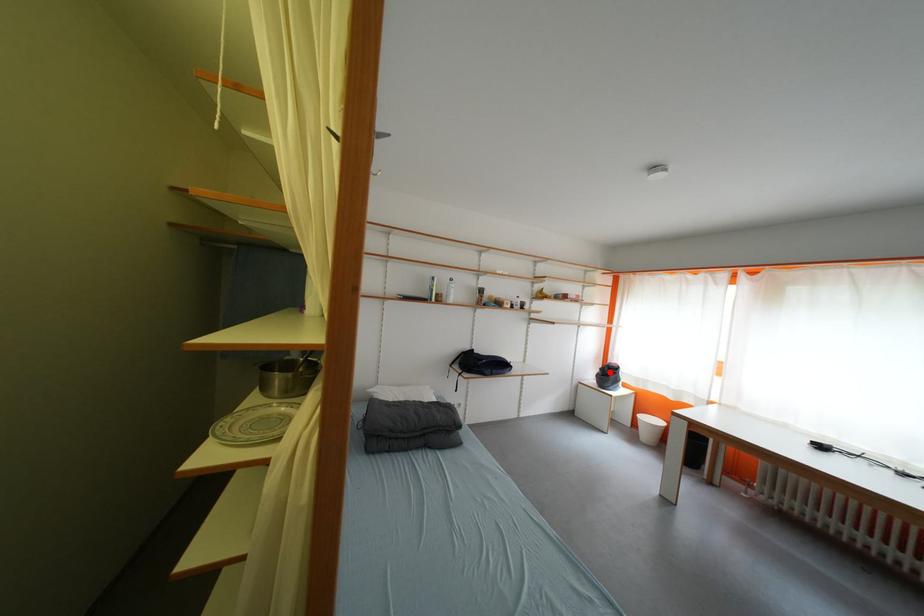
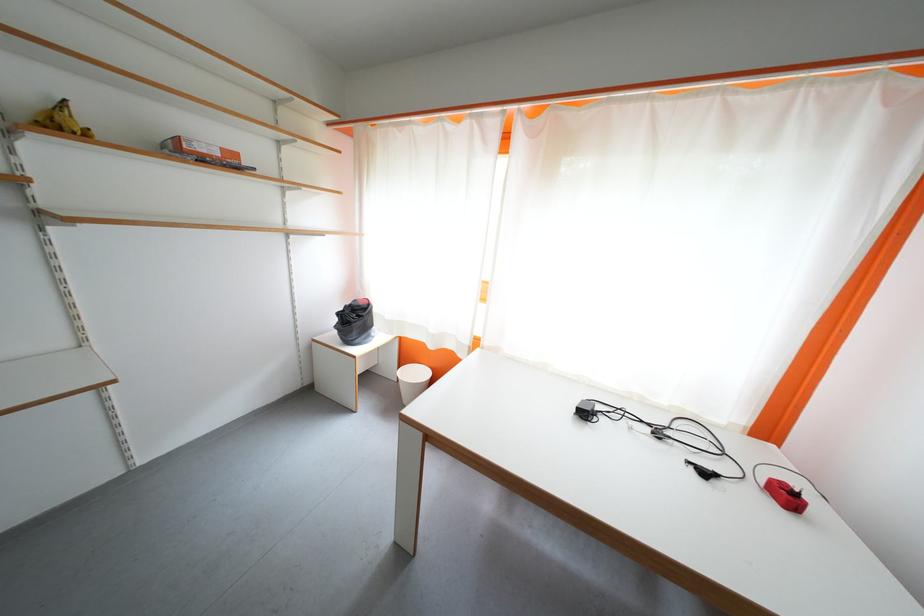
The point at the highlighted location is marked in the first image. Where is the corresponding point in the second image?

(347, 317)